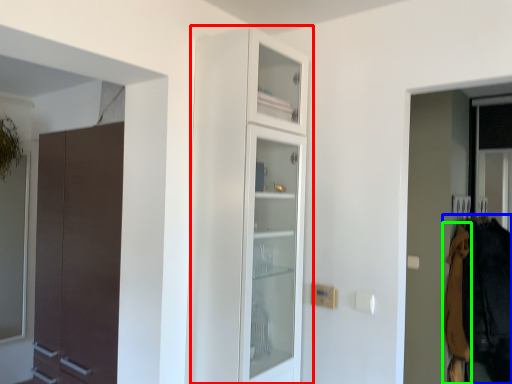
Question: Which object is the farthest from cupboard (highlighted by a red box)? Choose among these: clothing (highlighted by a blue box) or clothing (highlighted by a green box).

Choices:
 (A) clothing
 (B) clothing

Answer: (B)